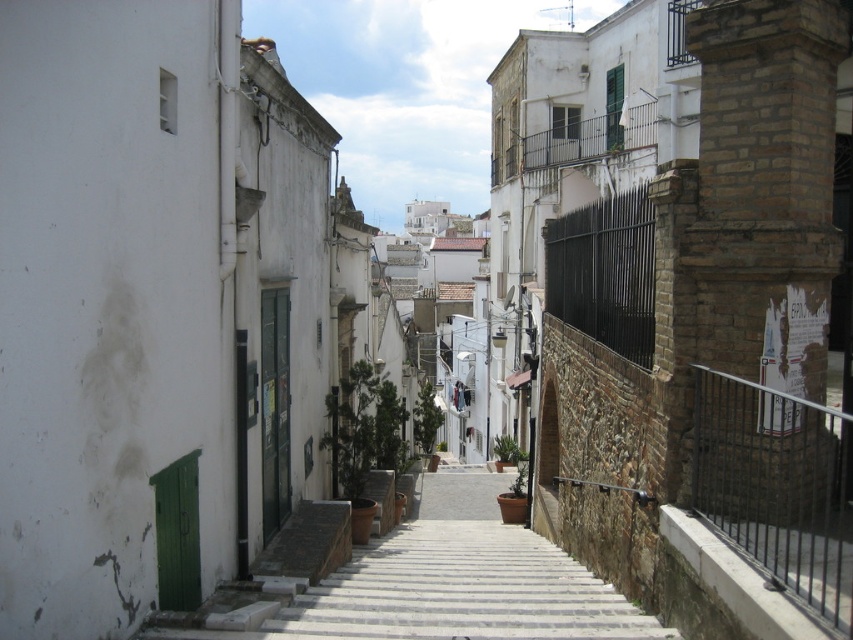
Can you confirm if white concrete stairs at center is bigger than black metal fence at right?

Correct, white concrete stairs at center is larger in size than black metal fence at right.

Between white concrete stairs at center and black metal fence at right, which one appears on the right side from the viewer's perspective?

Positioned to the right is black metal fence at right.

The image size is (853, 640). I want to click on white concrete stairs at center, so click(434, 584).